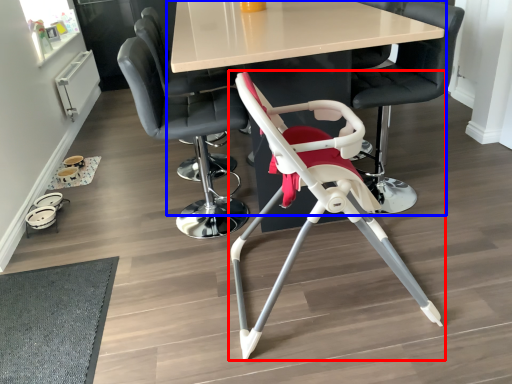
Question: Among these objects, which one is farthest to the camera, chair (highlighted by a red box) or table (highlighted by a blue box)?

Choices:
 (A) chair
 (B) table

Answer: (B)